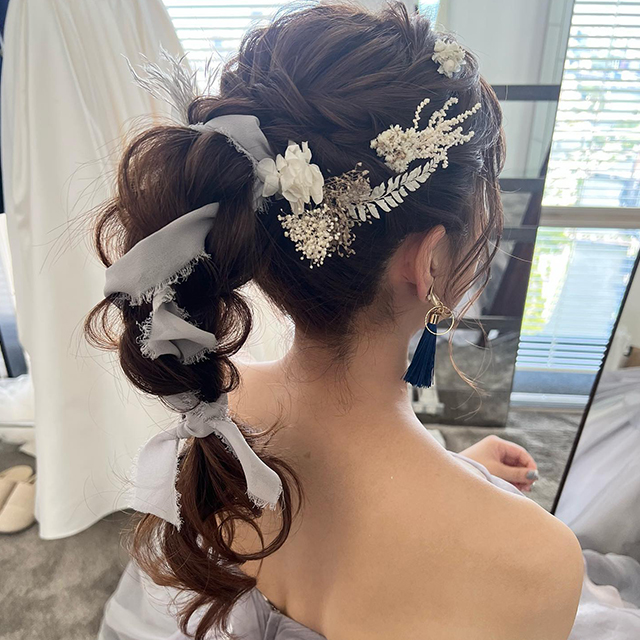
You are a GUI agent. You are given a task and a screenshot of the screen. Output one action in this format:
    pyautogui.click(x=<x>, y=<y>)
    Task: Click on the mirror
    This screenshot has width=640, height=640.
    Given the screenshot: What is the action you would take?
    pyautogui.click(x=586, y=467)